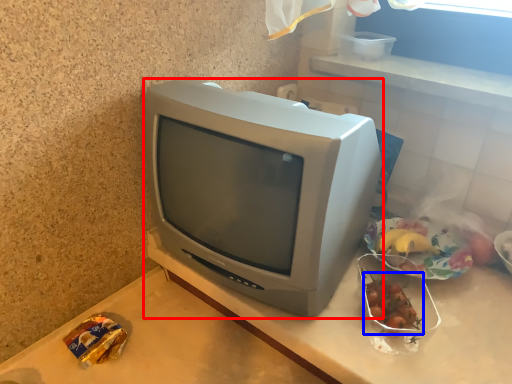
Question: Which object is further to the camera taking this photo, television (highlighted by a red box) or food (highlighted by a blue box)?

Choices:
 (A) television
 (B) food

Answer: (B)